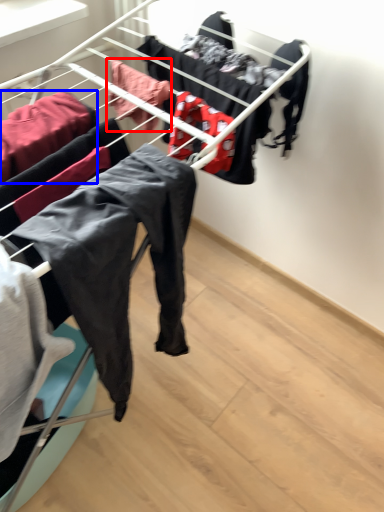
Question: Which point is further to the camera, clothing (highlighted by a red box) or clothing (highlighted by a blue box)?

Choices:
 (A) clothing
 (B) clothing

Answer: (A)